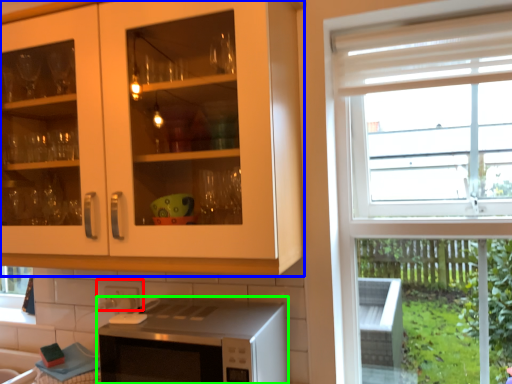
Question: Which object is the farthest from tile (highlighted by a red box)? Choose among these: cabinetry (highlighted by a blue box) or microwave oven (highlighted by a green box).

Choices:
 (A) cabinetry
 (B) microwave oven

Answer: (A)